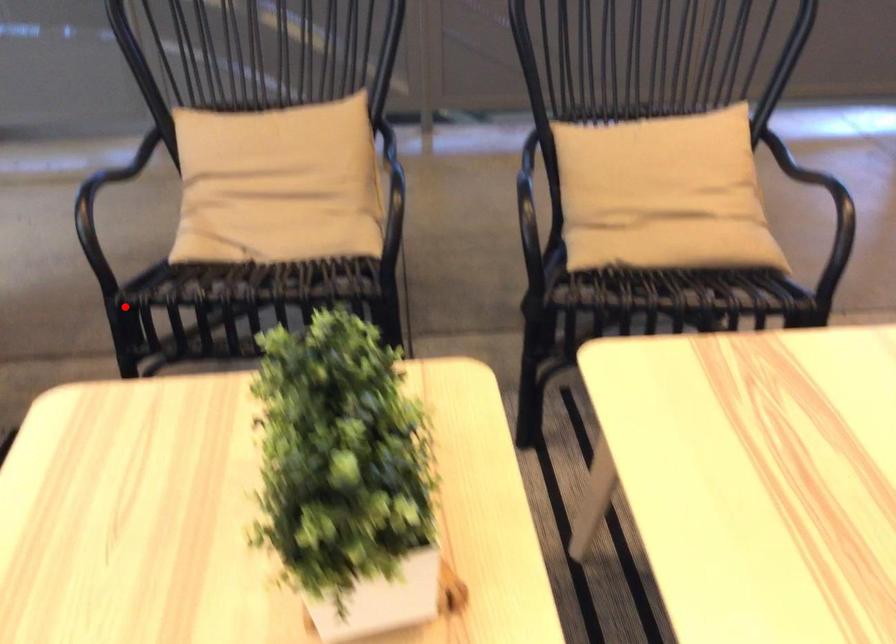
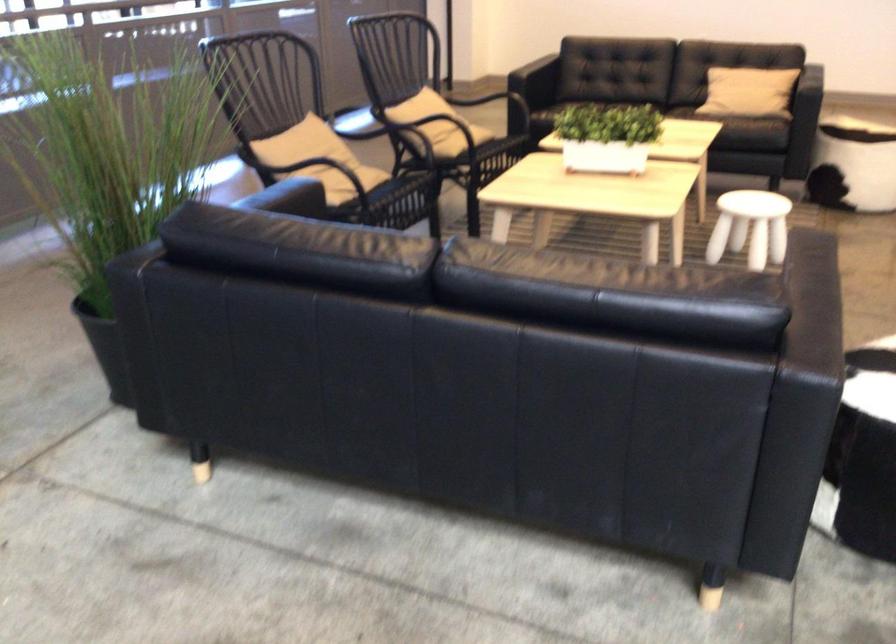
In the second image, find the point that corresponds to the highlighted location in the first image.

(382, 204)